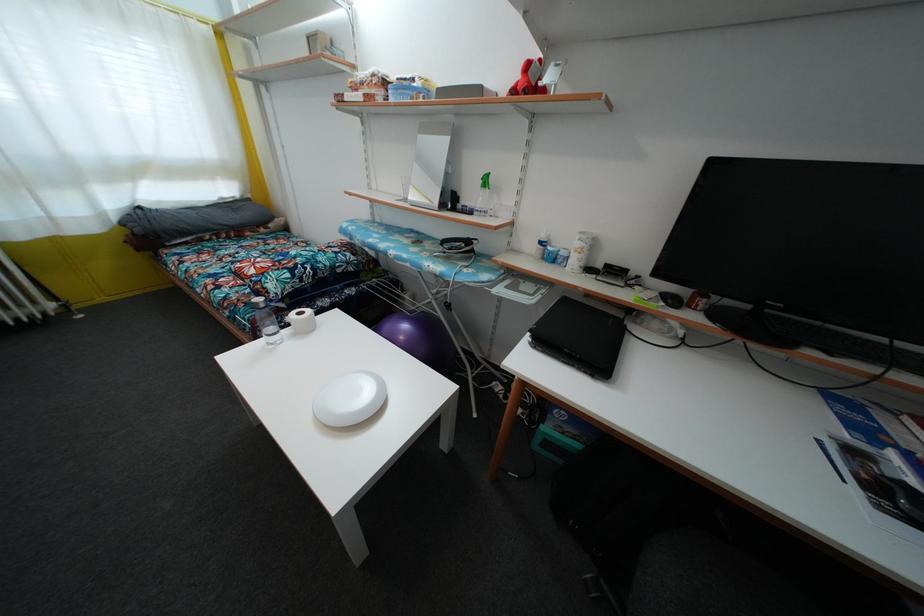
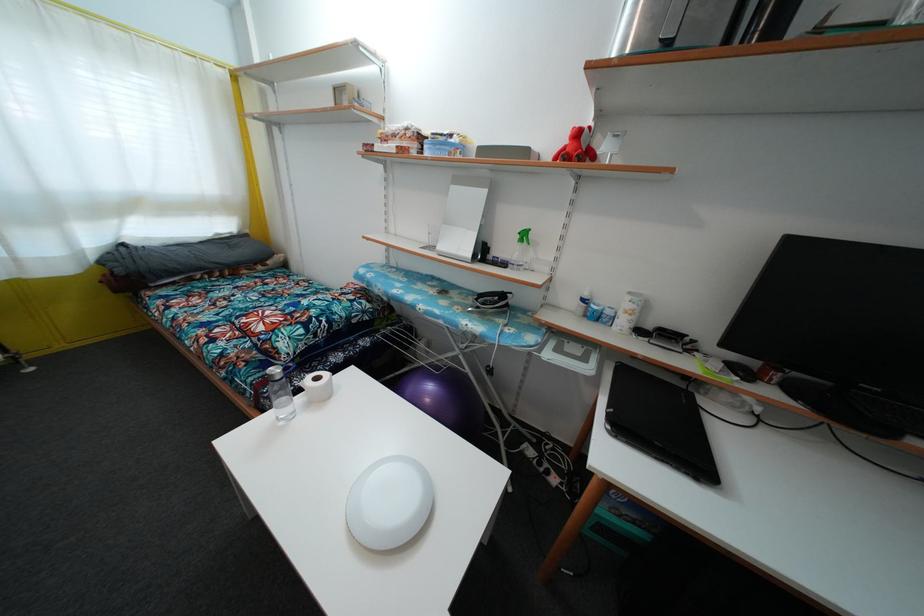
Locate, in the second image, the point that corresponds to pixel 406 345 in the first image.

(431, 407)